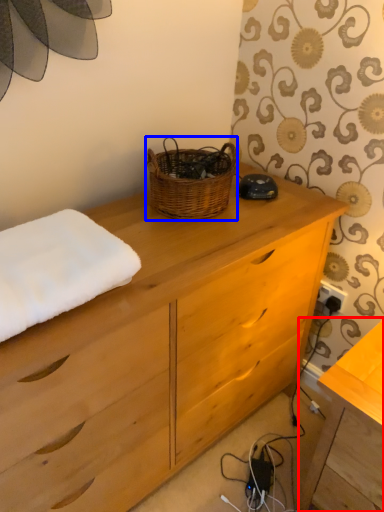
Question: Among these objects, which one is nearest to the camera, table (highlighted by a red box) or picnic basket (highlighted by a blue box)?

Choices:
 (A) table
 (B) picnic basket

Answer: (A)